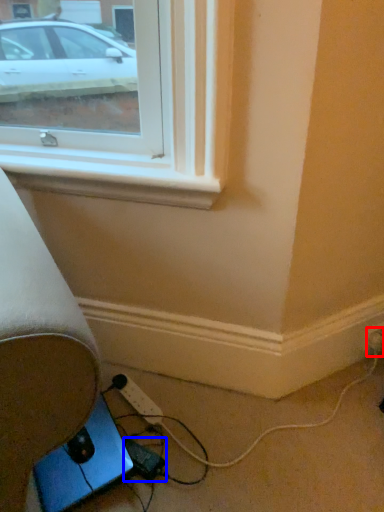
Question: Which point is closer to the camera, electric outlet (highlighted by a red box) or extension cord (highlighted by a blue box)?

Choices:
 (A) electric outlet
 (B) extension cord

Answer: (B)